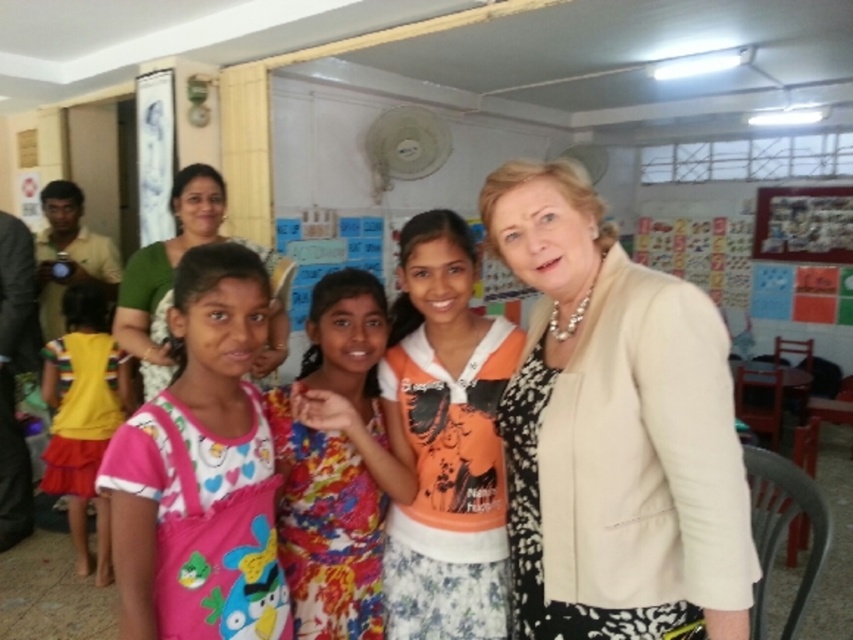
Question: Based on their relative distances, which object is farther from the floral fabric dress at center?

Choices:
 (A) floral dress at center
 (B) green fabric at upper left
 (C) black fabric jacket at left
 (D) pink fabric dress at left

Answer: (C)

Question: Can you confirm if pink fabric dress at left is positioned above black fabric jacket at left?

Choices:
 (A) yes
 (B) no

Answer: (A)

Question: Is beige fabric jacket at center bigger than green fabric at upper left?

Choices:
 (A) no
 (B) yes

Answer: (A)

Question: Which point is farther to the camera?

Choices:
 (A) (602, 353)
 (B) (15, 292)
 (C) (219, 456)
 (D) (350, 632)

Answer: (B)

Question: Considering the relative positions of pink fabric dress at left and floral dress at center in the image provided, where is pink fabric dress at left located with respect to floral dress at center?

Choices:
 (A) below
 (B) above

Answer: (B)

Question: Among these objects, which one is nearest to the camera?

Choices:
 (A) floral fabric dress at center
 (B) floral dress at center
 (C) green fabric at upper left

Answer: (A)